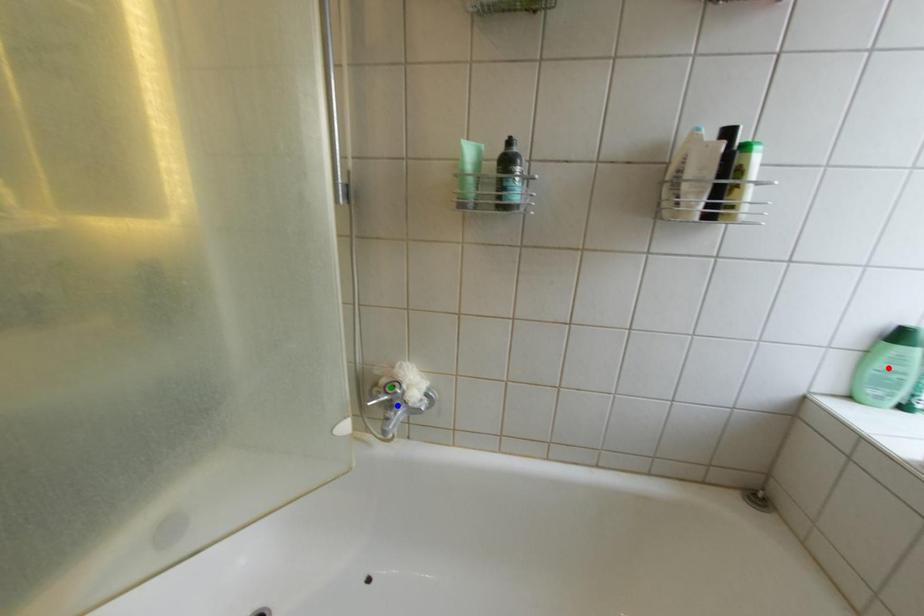
Order these from nearest to farthest:
- red point
- blue point
- green point

red point → blue point → green point